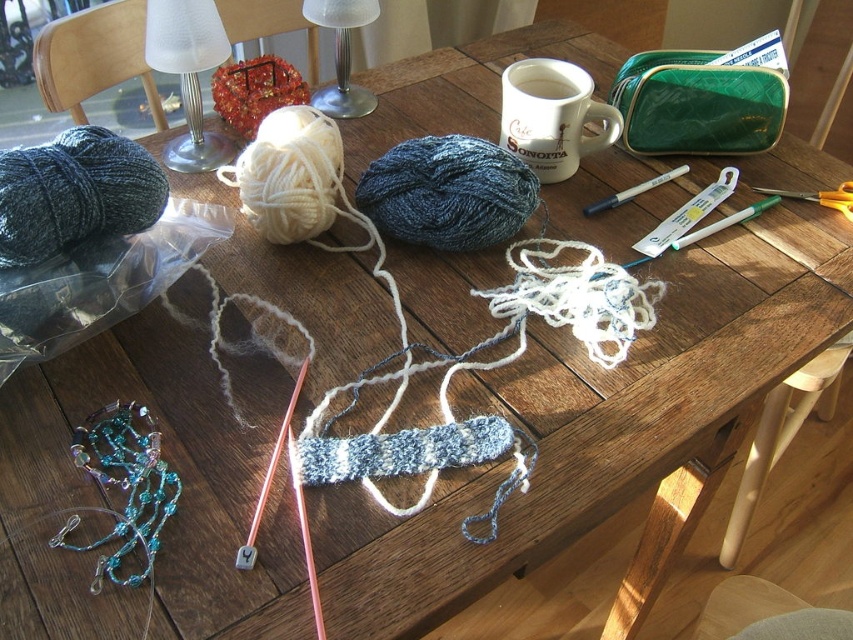
Question: Does dark blue yarn at center appear on the left side of white frosted glass lamp at upper left?

Choices:
 (A) yes
 (B) no

Answer: (B)

Question: Based on their relative distances, which object is nearer to the white frosted glass lamp at upper left?

Choices:
 (A) dark blue yarn at center
 (B) yellow plastic scissors at upper right
 (C) white frosted glass lamp at upper center
 (D) white ceramic mug at upper center

Answer: (C)

Question: Which point is closer to the camera?

Choices:
 (A) white frosted glass lamp at upper center
 (B) white ceramic mug at upper center

Answer: (B)

Question: Is dark blue yarn at center bigger than yellow plastic scissors at upper right?

Choices:
 (A) yes
 (B) no

Answer: (A)

Question: Does dark gray yarn at left appear under white frosted glass lamp at upper left?

Choices:
 (A) yes
 (B) no

Answer: (A)

Question: Which object appears farthest from the camera in this image?

Choices:
 (A) dark gray yarn at left
 (B) white frosted glass lamp at upper left

Answer: (B)